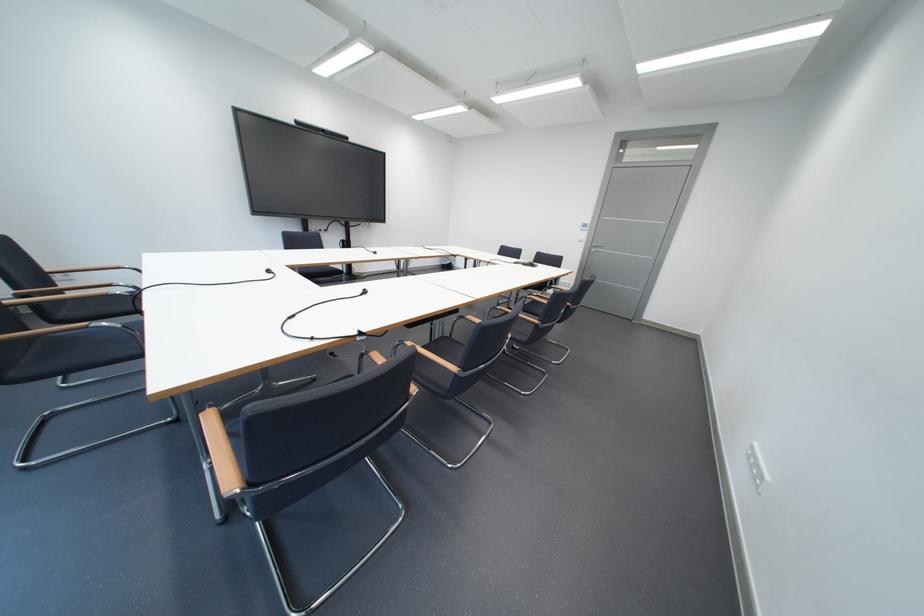
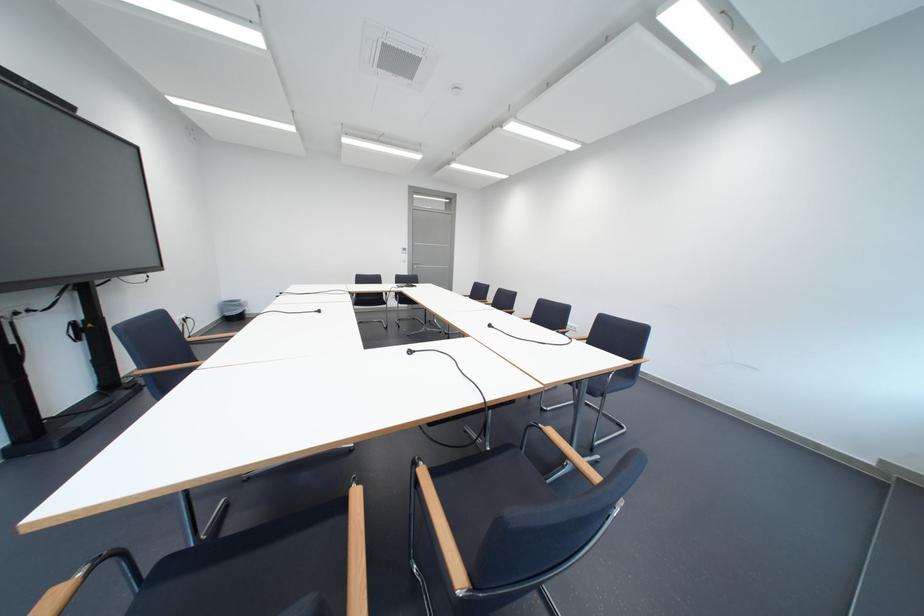
The point at (603, 248) is marked in the first image. Where is the corresponding point in the second image?

(426, 265)